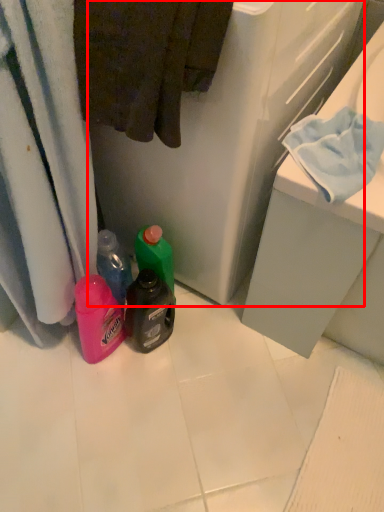
Question: Considering the relative positions of appliance (annotated by the red box) and bath towel in the image provided, where is appliance (annotated by the red box) located with respect to the staircase?

Choices:
 (A) left
 (B) right

Answer: (B)